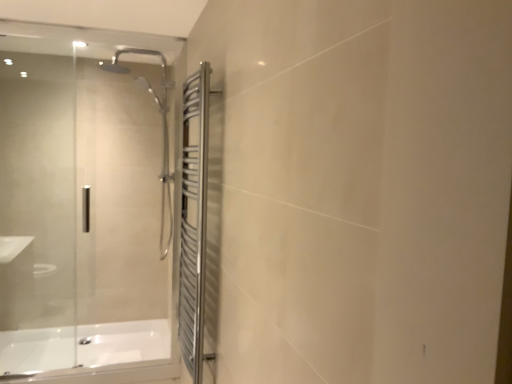
Question: Should I look upward or downward to see white glossy bathtub at lower left?

Choices:
 (A) down
 (B) up

Answer: (A)

Question: Can you see polished stainless steel towel rack at right touching transparent glass door at left?

Choices:
 (A) yes
 (B) no

Answer: (B)

Question: Does polished stainless steel towel rack at right have a lesser height compared to transparent glass door at left?

Choices:
 (A) yes
 (B) no

Answer: (A)

Question: Is polished stainless steel towel rack at right positioned behind transparent glass door at left?

Choices:
 (A) yes
 (B) no

Answer: (B)

Question: Does polished stainless steel towel rack at right turn towards transparent glass door at left?

Choices:
 (A) no
 (B) yes

Answer: (A)

Question: Considering the relative positions of polished stainless steel towel rack at right and transparent glass door at left in the image provided, is polished stainless steel towel rack at right to the left of transparent glass door at left from the viewer's perspective?

Choices:
 (A) no
 (B) yes

Answer: (A)

Question: Is polished stainless steel towel rack at right wider than transparent glass door at left?

Choices:
 (A) no
 (B) yes

Answer: (B)

Question: From the image's perspective, is transparent glass door at left below polished stainless steel towel rack at right?

Choices:
 (A) yes
 (B) no

Answer: (B)

Question: Can you confirm if transparent glass door at left is wider than polished stainless steel towel rack at right?

Choices:
 (A) no
 (B) yes

Answer: (A)

Question: Does transparent glass door at left lie behind polished stainless steel towel rack at right?

Choices:
 (A) no
 (B) yes

Answer: (B)

Question: Is transparent glass door at left at the left side of polished stainless steel towel rack at right?

Choices:
 (A) yes
 (B) no

Answer: (A)

Question: Is transparent glass door at left taller than polished stainless steel towel rack at right?

Choices:
 (A) yes
 (B) no

Answer: (A)

Question: Is transparent glass door at left not inside polished stainless steel towel rack at right?

Choices:
 (A) no
 (B) yes

Answer: (B)

Question: Considering the relative sizes of polished stainless steel towel rack at right and white glossy bathtub at lower left in the image provided, is polished stainless steel towel rack at right wider than white glossy bathtub at lower left?

Choices:
 (A) no
 (B) yes

Answer: (A)